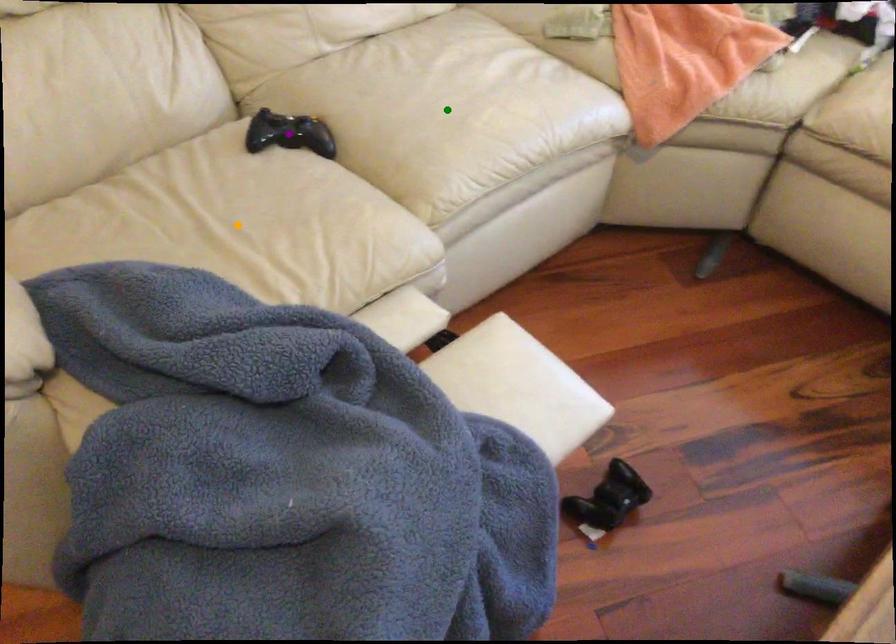
Order these from farthest to nearest:
green point | orange point | purple point

green point
purple point
orange point